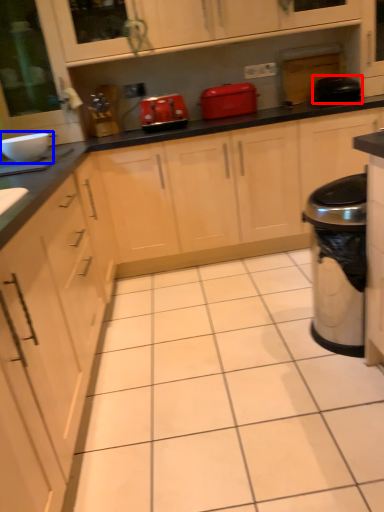
Question: Which of the following is the closest to the observer, appliance (highlighted by a red box) or appliance (highlighted by a blue box)?

Choices:
 (A) appliance
 (B) appliance

Answer: (B)